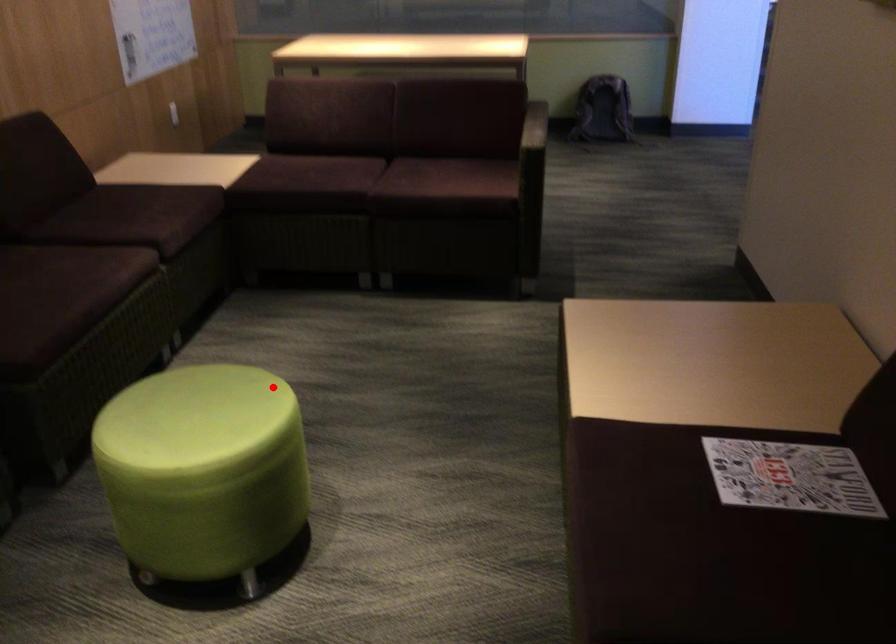
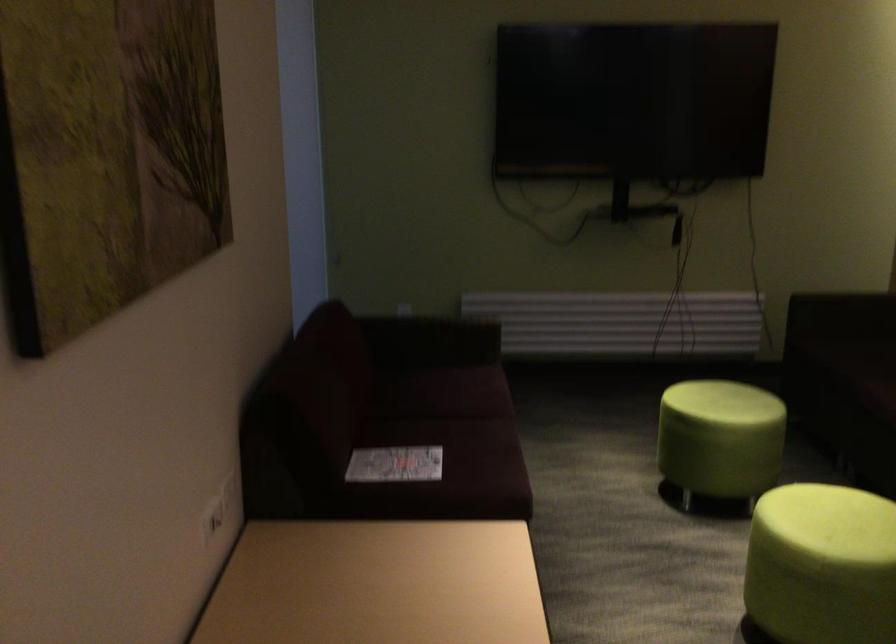
Locate, in the second image, the point that corresponds to the highlighted location in the first image.

(822, 565)